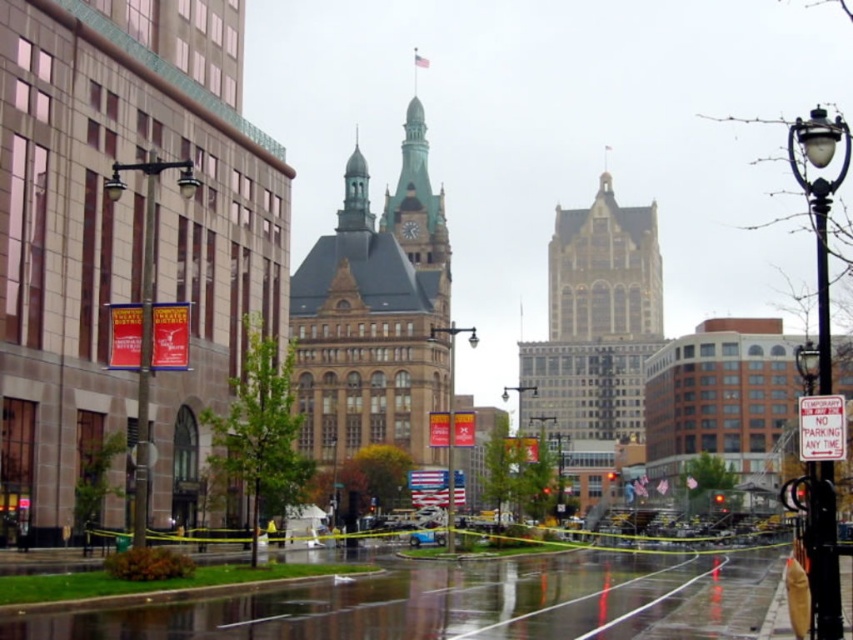
Between point (320, 252) and point (805, 125), which one is positioned in front?

Positioned in front is point (805, 125).

Does brown stone clock tower at center come in front of black metal streetlight at right?

No, it is not.

Which is behind, point (347, 212) or point (805, 195)?

Point (347, 212)

Identify the location of brown stone clock tower at center. The height and width of the screenshot is (640, 853). pyautogui.click(x=375, y=316).

Does brown stone clock tower at center lie in front of polished metal streetlight at left?

No, it is behind polished metal streetlight at left.

Which of these two, brown stone clock tower at center or polished metal streetlight at left, stands shorter?

With less height is polished metal streetlight at left.

What do you see at coordinates (375, 316) in the screenshot? I see `brown stone clock tower at center` at bounding box center [375, 316].

Locate an element on the screen. This screenshot has height=640, width=853. brown stone clock tower at center is located at coordinates (375, 316).

Does brown stone clock tower at center lie in front of metallic streetlamp at center?

No.

This screenshot has width=853, height=640. Find the location of `brown stone clock tower at center`. brown stone clock tower at center is located at coordinates (375, 316).

You are a GUI agent. You are given a task and a screenshot of the screen. Output one action in this format:
    pyautogui.click(x=<x>, y=<y>)
    Task: Click on the brown stone clock tower at center
    This screenshot has width=853, height=640.
    Given the screenshot: What is the action you would take?
    pyautogui.click(x=375, y=316)

You are a GUI agent. You are given a task and a screenshot of the screen. Output one action in this format:
    pyautogui.click(x=<x>, y=<y>)
    Task: Click on the brown stone clock tower at center
    The height and width of the screenshot is (640, 853).
    Given the screenshot: What is the action you would take?
    pyautogui.click(x=375, y=316)